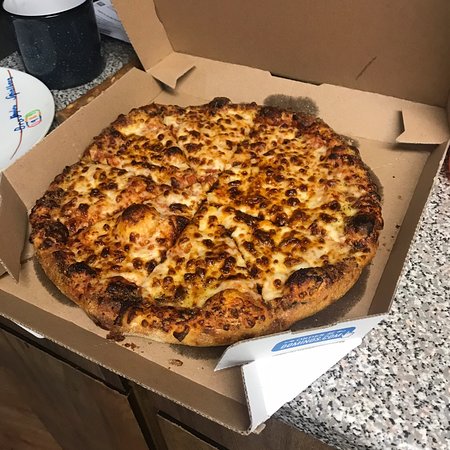
Where is `plate`? plate is located at coordinates (24, 89).